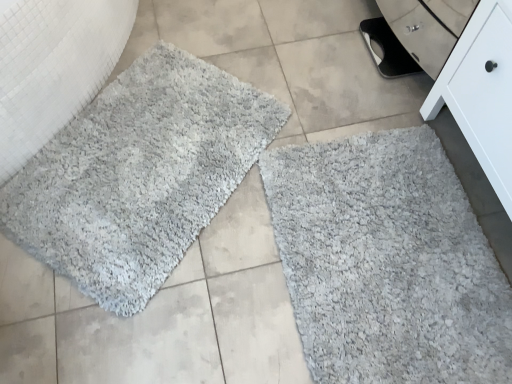
At what (x,y) coordinates should I click in order to perform the action: click on free point above gray shaggy bath mat at lower right, marked as the second bath mat in a left-to-right arrangement (from a real-world perspective). Please return your answer as a coordinate pair (x, y). This screenshot has width=512, height=384. Looking at the image, I should click on (392, 247).